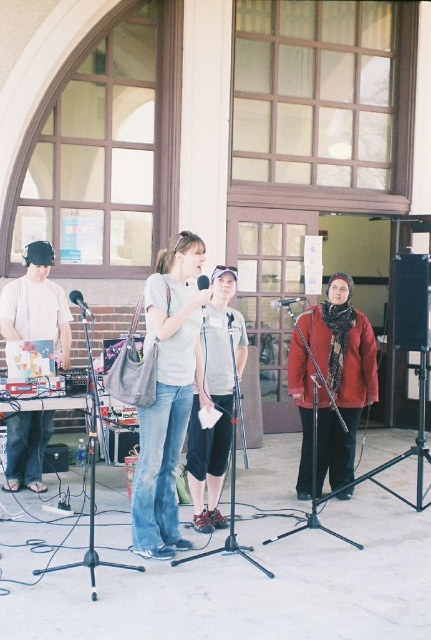
You are attending an outdoor event and notice two items on the stage. The matte white headphones at left and the matte gray shirt at center. Which item is shorter in height?

The matte white headphones at left has a lesser height compared to matte gray shirt at center, so the matte white headphones at left is shorter.

You are an event organizer checking the stage setup. You see the red woolen scarf at center and the matte black microphone at center. Which object is located to the right of the other?

The red woolen scarf at center is positioned on the right side of matte black microphone at center.